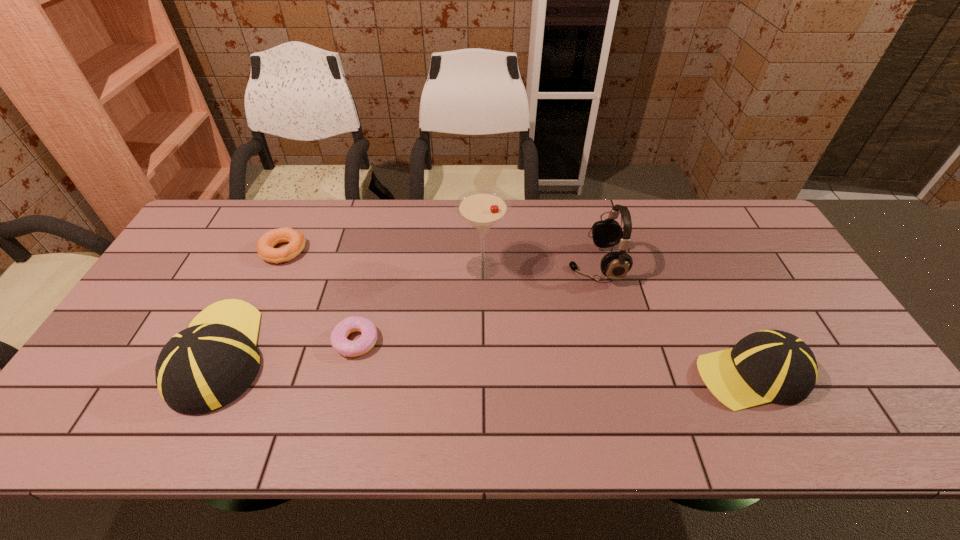
Identify the location of vacant space situated 0.240m with the brim of the third tallest object facing forward. (272, 248).

Image resolution: width=960 pixels, height=540 pixels. In order to click on free space located with the brim of the third tallest object facing forward in this screenshot , I will do click(x=283, y=224).

This screenshot has height=540, width=960. I want to click on vacant space located with the brim of the rightmost object facing forward, so click(x=572, y=374).

Locate an element on the screen. free space located 0.190m with the brim of the rightmost object facing forward is located at coordinates (617, 374).

Image resolution: width=960 pixels, height=540 pixels. What are the coordinates of `vacant space situated with the brim of the rightmost object facing forward` in the screenshot? It's located at (536, 374).

The image size is (960, 540). I want to click on vacant space located 0.220m on the left of the bagel, so click(x=190, y=251).

Locate an element on the screen. The height and width of the screenshot is (540, 960). free space located 0.270m with the microphone on the side of the second tallest object is located at coordinates (479, 264).

Identify the location of free spot located with the microphone on the side of the second tallest object. (492, 264).

At what (x,y) coordinates should I click in order to perform the action: click on vacant space located 0.390m with the microphone on the side of the second tallest object. Please return your answer as a coordinate pair (x, y). Looking at the image, I should click on (440, 264).

Where is `vacant space located on the left of the third object from right to left`? vacant space located on the left of the third object from right to left is located at coordinates (382, 267).